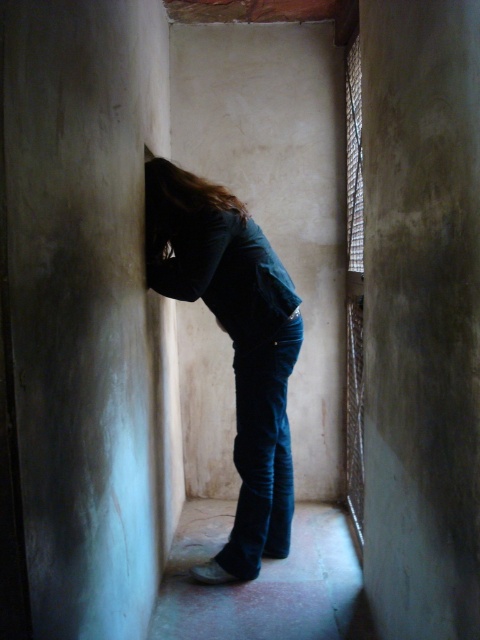
Question: Where is dark blue jeans at center located in relation to brown smooth hair at center in the image?

Choices:
 (A) right
 (B) left

Answer: (A)

Question: Can you confirm if dark blue jeans at center is bigger than brown smooth hair at center?

Choices:
 (A) no
 (B) yes

Answer: (B)

Question: Which object is farther from the camera taking this photo?

Choices:
 (A) dark blue jeans at center
 (B) brown smooth hair at center

Answer: (B)

Question: Is dark blue jeans at center wider than brown smooth hair at center?

Choices:
 (A) no
 (B) yes

Answer: (B)

Question: Which object is farther from the camera taking this photo?

Choices:
 (A) brown smooth hair at center
 (B) dark blue jeans at center

Answer: (A)

Question: Which of the following is the farthest from the observer?

Choices:
 (A) dark blue jeans at center
 (B) brown smooth hair at center

Answer: (B)